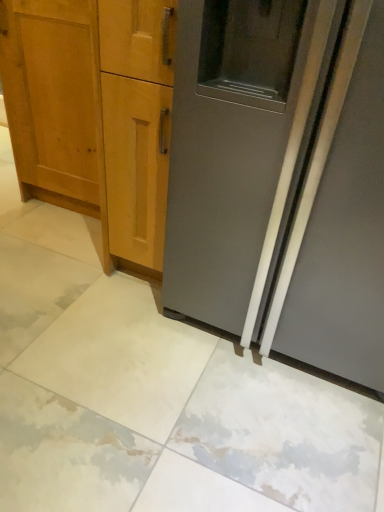
Question: From a real-world perspective, does light brown wood cabinet at left sit lower than satin gray refrigerator at right?

Choices:
 (A) yes
 (B) no

Answer: (A)

Question: Is light brown wood cabinet at left in front of satin gray refrigerator at right?

Choices:
 (A) yes
 (B) no

Answer: (B)

Question: Is light brown wood cabinet at left smaller than satin gray refrigerator at right?

Choices:
 (A) no
 (B) yes

Answer: (B)

Question: Would you consider light brown wood cabinet at left to be distant from satin gray refrigerator at right?

Choices:
 (A) no
 (B) yes

Answer: (A)

Question: Is satin gray refrigerator at right located within light brown wood cabinet at left?

Choices:
 (A) yes
 (B) no

Answer: (B)

Question: Does light brown wood cabinet at left have a greater height compared to satin gray refrigerator at right?

Choices:
 (A) no
 (B) yes

Answer: (A)

Question: Considering the relative positions of satin gray refrigerator at right and light brown wood cabinet at left in the image provided, is satin gray refrigerator at right to the right of light brown wood cabinet at left from the viewer's perspective?

Choices:
 (A) no
 (B) yes

Answer: (B)

Question: Is light brown wood cabinet at left at the back of satin gray refrigerator at right?

Choices:
 (A) no
 (B) yes

Answer: (A)

Question: From a real-world perspective, is satin gray refrigerator at right physically above light brown wood cabinet at left?

Choices:
 (A) no
 (B) yes

Answer: (B)

Question: From the image's perspective, is satin gray refrigerator at right over light brown wood cabinet at left?

Choices:
 (A) no
 (B) yes

Answer: (A)

Question: Is satin gray refrigerator at right positioned before light brown wood cabinet at left?

Choices:
 (A) yes
 (B) no

Answer: (A)

Question: Can you see satin gray refrigerator at right touching light brown wood cabinet at left?

Choices:
 (A) yes
 (B) no

Answer: (B)

Question: From the image's perspective, is satin gray refrigerator at right above or below light brown wood cabinet at left?

Choices:
 (A) below
 (B) above

Answer: (A)